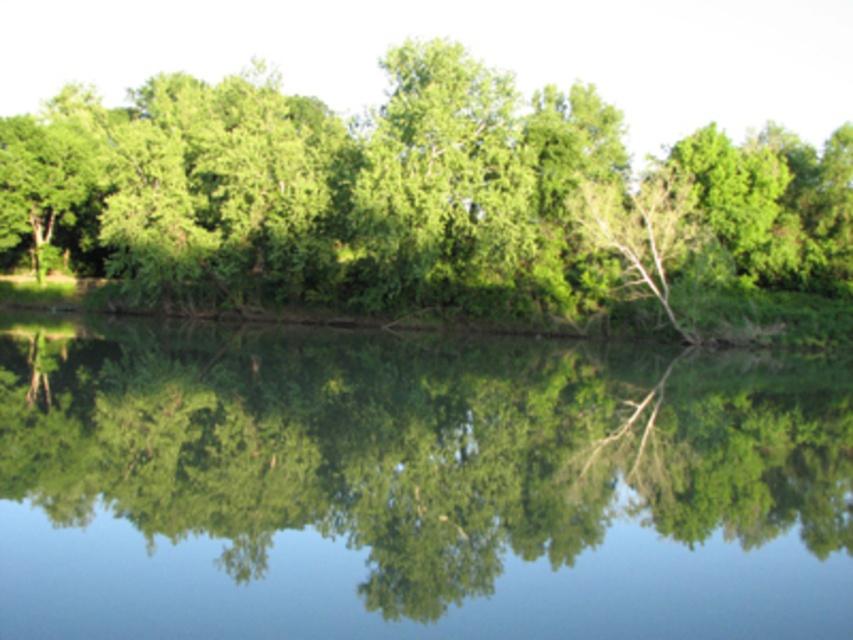
Measure the distance from green reflective water at center to green leafy tree at center.

green reflective water at center is 26.62 meters from green leafy tree at center.

Does green reflective water at center come in front of green leafy tree at center?

Yes, it is.

Describe the element at coordinates (412, 486) in the screenshot. I see `green reflective water at center` at that location.

The height and width of the screenshot is (640, 853). I want to click on green reflective water at center, so (x=412, y=486).